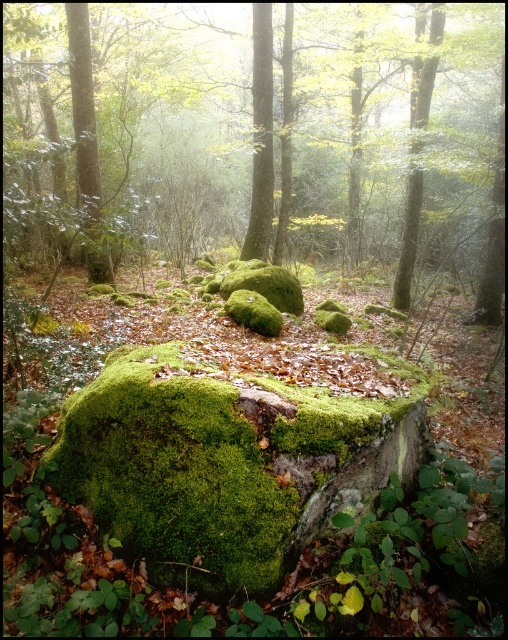
You are a hiker who wants to place a small camping stool between the green mossy rock at center and the green mossy rock at left. Considering their heights, which rock will the stool be closer to?

The green mossy rock at center is much taller than the green mossy rock at left. Therefore, the stool will be closer to the shorter green mossy rock at left since it is lower in height.

You are standing in the forest and want to place a small potted plant exactly at the center of the image. The green mossy rock at center is already occupying a spot. Can you place the potted plant at the center without overlapping the rock?

The green mossy rock at center is located at point (263, 136), which is not the exact center of the image. Therefore, you can place the potted plant at the true center without overlapping the rock.